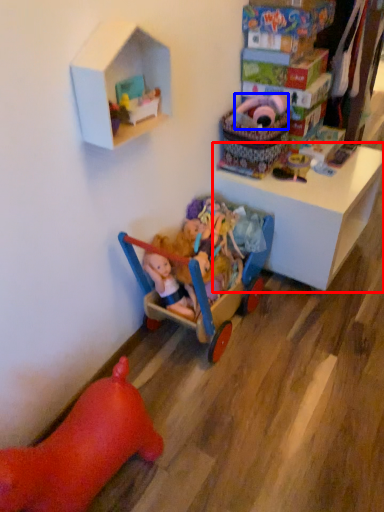
Question: Which object is closer to the camera taking this photo, table (highlighted by a red box) or toy (highlighted by a blue box)?

Choices:
 (A) table
 (B) toy

Answer: (B)